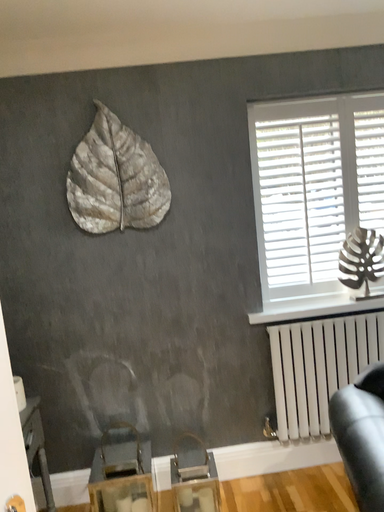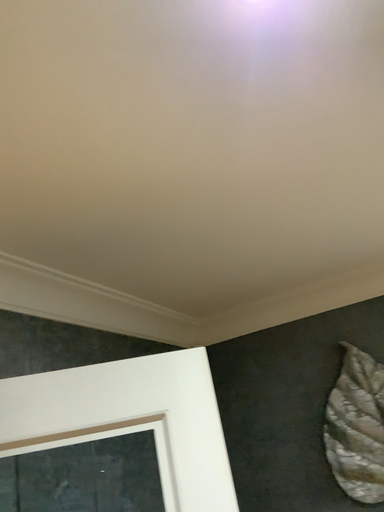
Question: Which way did the camera rotate in the video?

Choices:
 (A) rotated upward
 (B) rotated downward

Answer: (A)